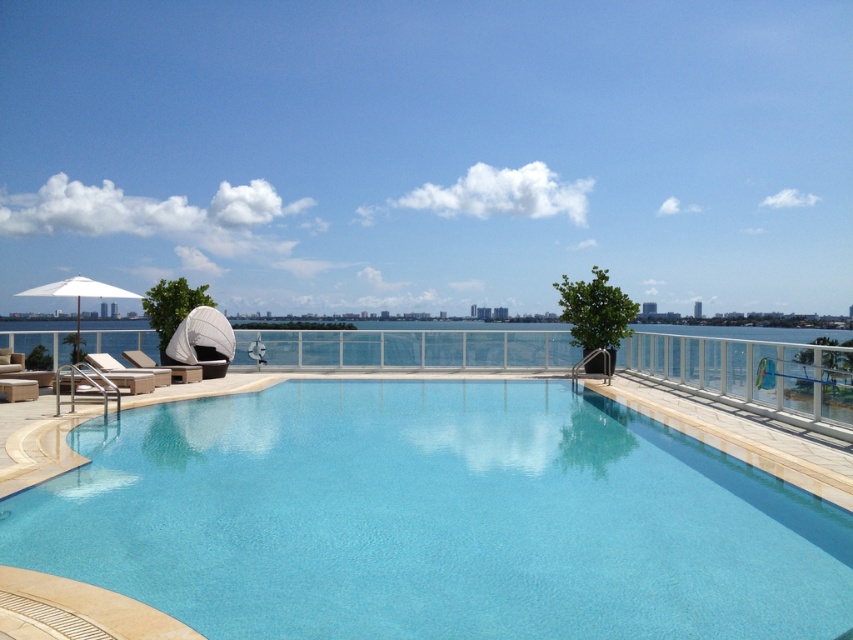
You are a lifeguard standing at the edge of the clear glass swimming pool at center and need to reach the beige fabric lounge chair at lower left to retrieve a first aid kit. Considering your average walking speed is 1.5 meters per second, how many seconds will it take you to reach the lounge chair?

The distance between the clear glass swimming pool at center and the beige fabric lounge chair at lower left is 8.94 meters. At a walking speed of 1.5 meters per second, it would take approximately 5.96 seconds to reach the lounge chair.

You are planning to install a new light fixture that needs to be mounted at the same height as the highest point between the white fabric umbrella at upper left and the beige fabric lounge chair at left. Which object should you use as a reference for the height?

The white fabric umbrella at upper left has a greater height compared to the beige fabric lounge chair at left, so you should use the white fabric umbrella at upper left as the reference for the height.

You are standing at the edge of the clear glass swimming pool at center and want to reach the white fabric lounge chair at left. Which direction should you walk to get there?

Since the clear glass swimming pool at center is closer to you than the white fabric lounge chair at left, you should walk towards the left side of the pool to reach the lounge chair.